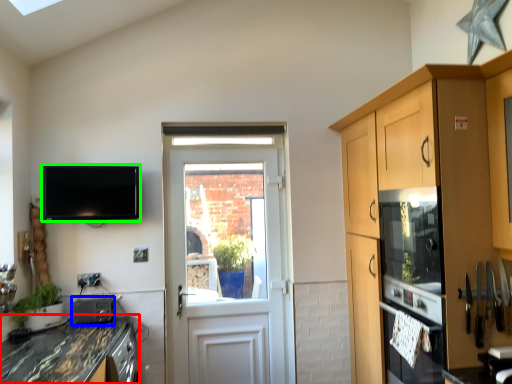
Question: Based on their relative distances, which object is nearer to countertop (highlighted by a red box)? Choose from appliance (highlighted by a blue box) and television (highlighted by a green box).

Choices:
 (A) appliance
 (B) television

Answer: (A)